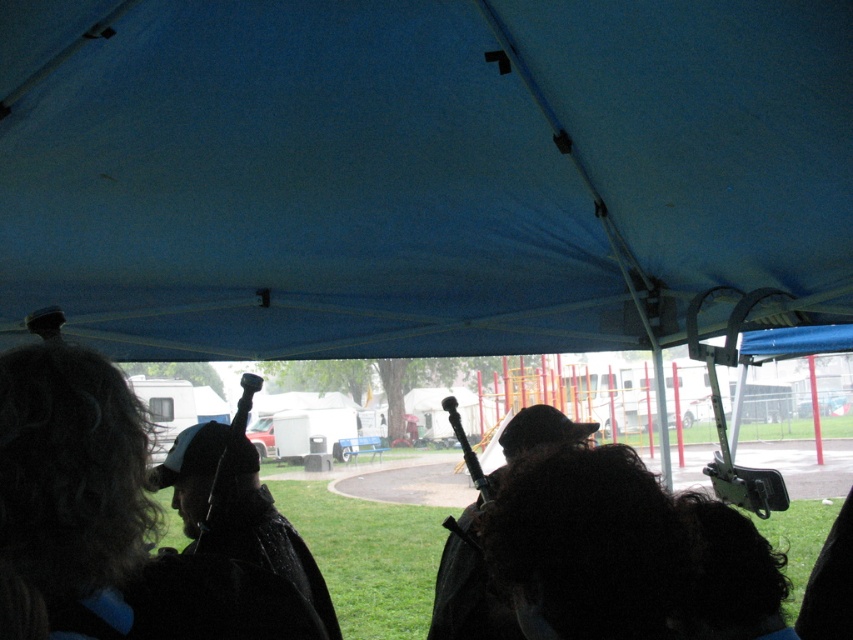
Question: Which of the following is the farthest from the observer?

Choices:
 (A) (451, 522)
 (B) (114, 243)

Answer: (B)

Question: Which point is closer to the camera?

Choices:
 (A) blue fabric canopy at upper center
 (B) black matte jacket at lower left

Answer: (B)

Question: Is dark brown leather bag at center wider than metallic black microphone at center?

Choices:
 (A) yes
 (B) no

Answer: (A)

Question: Among these points, which one is farthest from the camera?

Choices:
 (A) (521, 592)
 (B) (560, 444)
 (C) (224, 451)

Answer: (C)

Question: Does dark curly hair at lower left appear over dark brown leather bag at center?

Choices:
 (A) no
 (B) yes

Answer: (B)

Question: Does black matte jacket at lower left have a greater width compared to metallic black microphone at center?

Choices:
 (A) no
 (B) yes

Answer: (B)